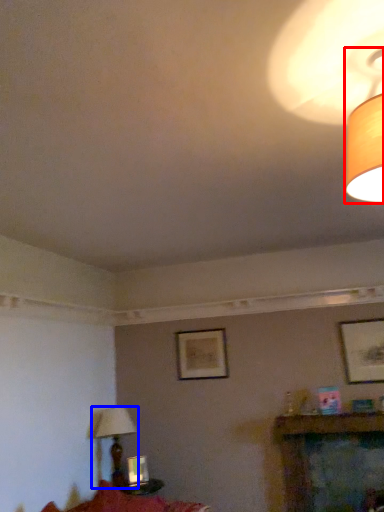
Question: Which object appears closest to the camera in this image, lamp (highlighted by a red box) or lamp (highlighted by a blue box)?

Choices:
 (A) lamp
 (B) lamp

Answer: (A)